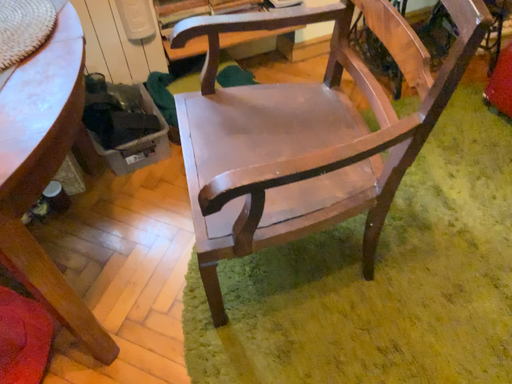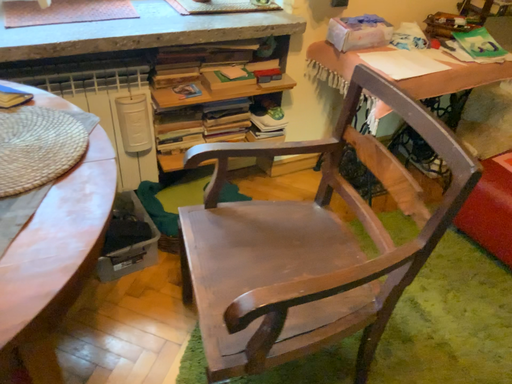
Question: How did the camera likely rotate when shooting the video?

Choices:
 (A) rotated right
 (B) rotated left

Answer: (A)